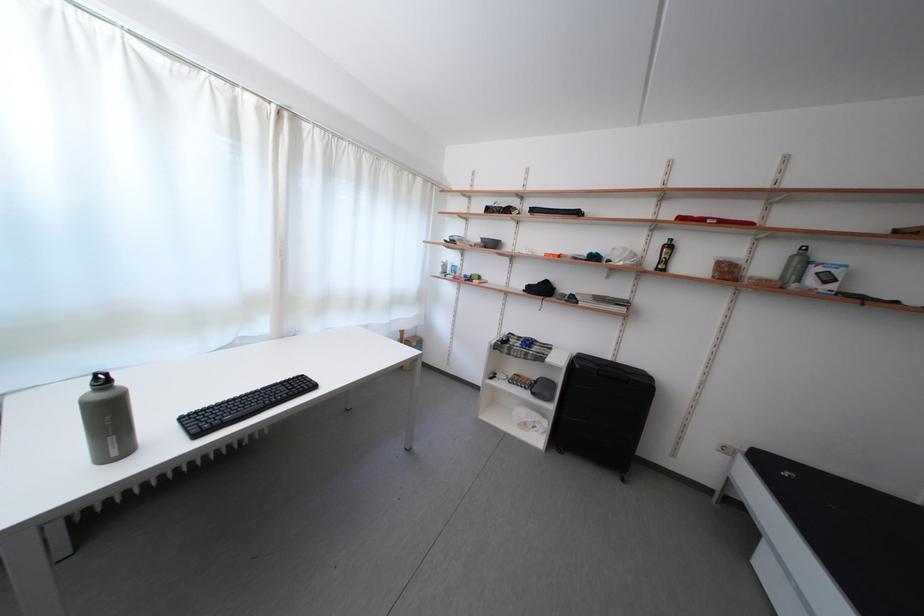
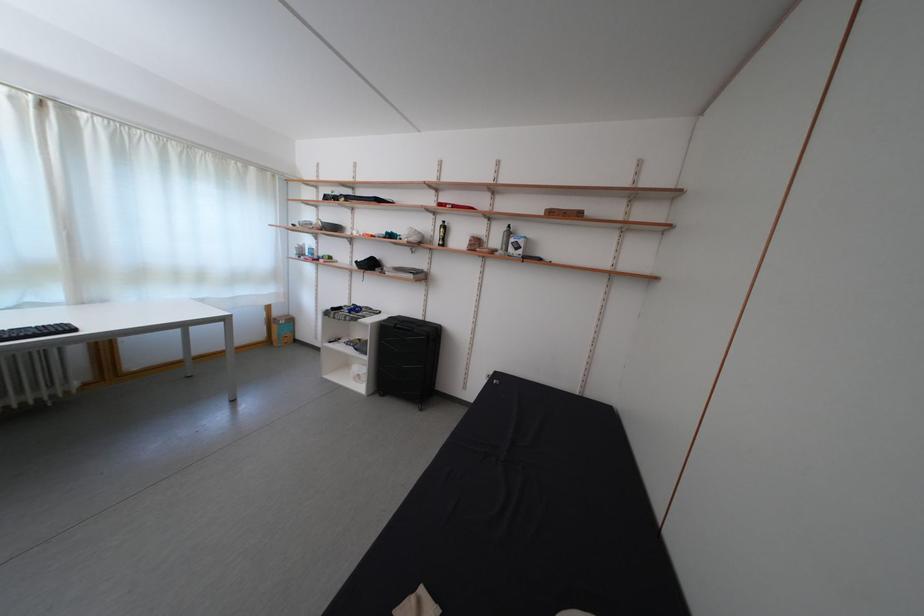
In the second image, find the point that corresponds to (465,235) in the first image.

(319, 221)